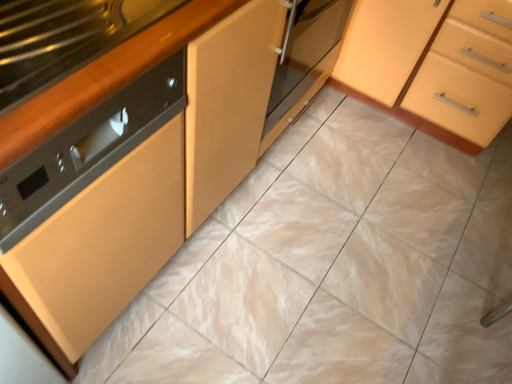
Measure the distance between black glossy countertop at left and camera.

They are 21.32 inches apart.

Where is `black glossy countertop at left`? This screenshot has height=384, width=512. black glossy countertop at left is located at coordinates (105, 77).

Describe the element at coordinates (105, 77) in the screenshot. I see `black glossy countertop at left` at that location.

Where is `matte orange cabinet at center-right`? The height and width of the screenshot is (384, 512). matte orange cabinet at center-right is located at coordinates (431, 66).

Describe the element at coordinates (431, 66) in the screenshot. This screenshot has height=384, width=512. I see `matte orange cabinet at center-right` at that location.

This screenshot has height=384, width=512. I want to click on black glossy countertop at left, so click(105, 77).

Is matte orange cabinet at center-right to the left of black glossy countertop at left from the viewer's perspective?

No, matte orange cabinet at center-right is not to the left of black glossy countertop at left.

Is matte orange cabinet at center-right positioned in front of black glossy countertop at left?

No, matte orange cabinet at center-right is further to the viewer.

Considering the points (430, 113) and (94, 80), which point is in front, point (430, 113) or point (94, 80)?

Positioned in front is point (94, 80).

From the image's perspective, is matte orange cabinet at center-right positioned above or below black glossy countertop at left?

Based on their image positions, matte orange cabinet at center-right is located above black glossy countertop at left.

From a real-world perspective, who is located lower, matte orange cabinet at center-right or black glossy countertop at left?

matte orange cabinet at center-right.

Considering the relative sizes of matte orange cabinet at center-right and black glossy countertop at left in the image provided, is matte orange cabinet at center-right thinner than black glossy countertop at left?

In fact, matte orange cabinet at center-right might be wider than black glossy countertop at left.

In the scene shown: Which of these two, matte orange cabinet at center-right or black glossy countertop at left, stands shorter?

Standing shorter between the two is black glossy countertop at left.

Considering the sizes of matte orange cabinet at center-right and black glossy countertop at left in the image, is matte orange cabinet at center-right bigger or smaller than black glossy countertop at left?

Clearly, matte orange cabinet at center-right is larger in size than black glossy countertop at left.

Can black glossy countertop at left be found inside matte orange cabinet at center-right?

Definitely not — black glossy countertop at left is not inside matte orange cabinet at center-right.

Are matte orange cabinet at center-right and black glossy countertop at left located far from each other?

Absolutely, matte orange cabinet at center-right is distant from black glossy countertop at left.

In the scene shown: Does matte orange cabinet at center-right turn towards black glossy countertop at left?

Yes.

Looking at this image, how different are the orientations of matte orange cabinet at center-right and black glossy countertop at left in degrees?

The angle between the facing direction of matte orange cabinet at center-right and the facing direction of black glossy countertop at left is 89.1 degrees.

How much distance is there between matte orange cabinet at center-right and black glossy countertop at left?

A distance of 1.17 meters exists between matte orange cabinet at center-right and black glossy countertop at left.

Locate an element on the screen. Image resolution: width=512 pixels, height=384 pixels. cabinetry behind the black glossy countertop at left is located at coordinates (431, 66).

Based on their positions, is black glossy countertop at left located to the left or right of matte orange cabinet at center-right?

→ Clearly, black glossy countertop at left is on the left of matte orange cabinet at center-right in the image.

Which object is further away from the camera taking this photo, black glossy countertop at left or matte orange cabinet at center-right?

Positioned behind is matte orange cabinet at center-right.

Is point (189, 33) less distant than point (495, 110)?

Yes, it is in front of point (495, 110).

From the image's perspective, is black glossy countertop at left above or below matte orange cabinet at center-right?

From the image's perspective, black glossy countertop at left appears below matte orange cabinet at center-right.

From a real-world perspective, is black glossy countertop at left below matte orange cabinet at center-right?

No, from a real-world perspective, black glossy countertop at left is not below matte orange cabinet at center-right.

Can you confirm if black glossy countertop at left is wider than matte orange cabinet at center-right?

No.

Between black glossy countertop at left and matte orange cabinet at center-right, which one has more height?

matte orange cabinet at center-right is taller.

Consider the image. Considering the sizes of objects black glossy countertop at left and matte orange cabinet at center-right in the image provided, who is smaller, black glossy countertop at left or matte orange cabinet at center-right?

black glossy countertop at left.

From the picture: Is black glossy countertop at left surrounding matte orange cabinet at center-right?

No, matte orange cabinet at center-right is not surrounded by black glossy countertop at left.

Is black glossy countertop at left not close to matte orange cabinet at center-right?

Yes, black glossy countertop at left and matte orange cabinet at center-right are quite far apart.

Does black glossy countertop at left turn towards matte orange cabinet at center-right?

No, black glossy countertop at left is not turned towards matte orange cabinet at center-right.

How different are the orientations of black glossy countertop at left and matte orange cabinet at center-right in degrees?

They differ by 89.1 degrees in their facing directions.

The width and height of the screenshot is (512, 384). Find the location of `cabinetry on the right of black glossy countertop at left`. cabinetry on the right of black glossy countertop at left is located at coordinates (431, 66).

Where is `counter top in front of the matte orange cabinet at center-right`? counter top in front of the matte orange cabinet at center-right is located at coordinates (105, 77).

I want to click on counter top below the matte orange cabinet at center-right (from the image's perspective), so click(x=105, y=77).